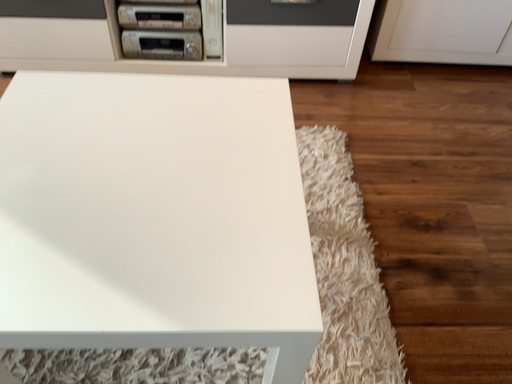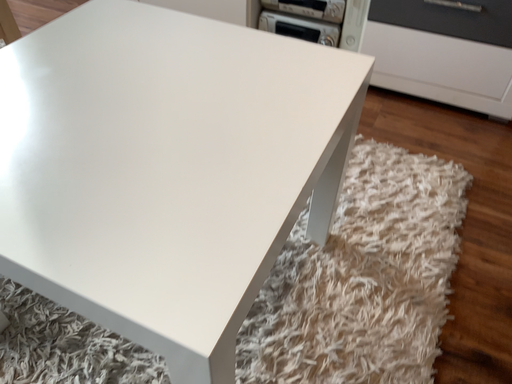
Question: Which way did the camera rotate in the video?

Choices:
 (A) rotated upward
 (B) rotated downward

Answer: (A)